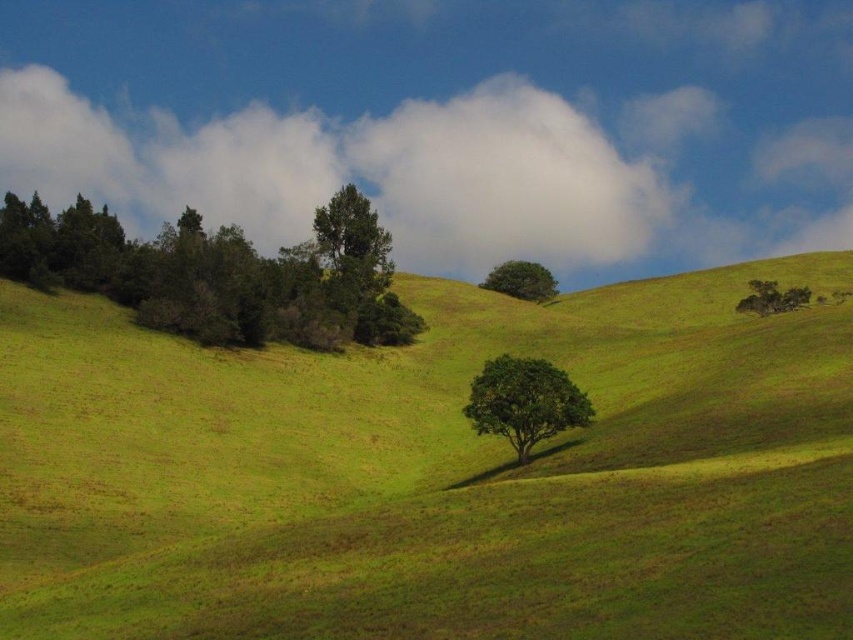
Does green leafy tree at center appear on the left side of green leafy tree at upper center?

Incorrect, green leafy tree at center is not on the left side of green leafy tree at upper center.

Is green leafy tree at center to the right of green leafy tree at upper center from the viewer's perspective?

Correct, you'll find green leafy tree at center to the right of green leafy tree at upper center.

Who is more forward, (x=514, y=358) or (x=326, y=248)?

Point (x=514, y=358) is more forward.

The image size is (853, 640). Identify the location of green leafy tree at center. (524, 401).

Between white fluffy cloud at upper center and green leafy tree at upper right, which one is positioned higher?

Positioned higher is white fluffy cloud at upper center.

Measure the distance from white fluffy cloud at upper center to green leafy tree at upper right.

990.26 feet

Is point (433, 257) more distant than point (759, 301)?

Yes.

The image size is (853, 640). Identify the location of white fluffy cloud at upper center. (503, 182).

Which is behind, point (358, 248) or point (796, 296)?

Positioned behind is point (358, 248).

Can you confirm if green leafy tree at upper center is positioned to the right of green leafy tree at upper right?

Incorrect, green leafy tree at upper center is not on the right side of green leafy tree at upper right.

Describe the element at coordinates (352, 236) in the screenshot. This screenshot has height=640, width=853. I see `green leafy tree at upper center` at that location.

Identify the location of green leafy tree at upper center. (352, 236).